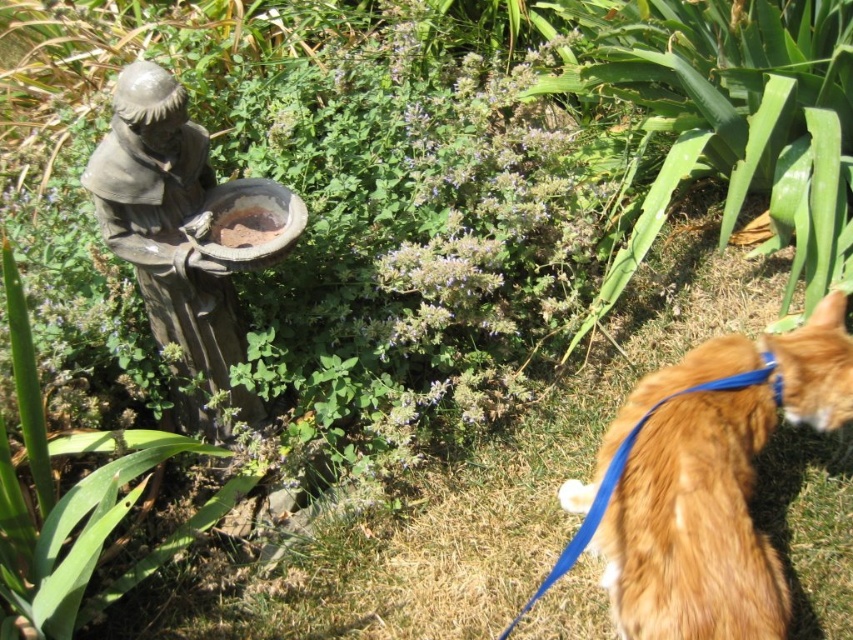
You are a photographer standing in the garden and want to take a picture of both the gray stone statue at upper left and the matte brown bowl at center. However, you notice that the statue is blocking part of the bowl. Can you adjust your position to capture both objects fully in the frame without any obstruction?

The gray stone statue at upper left is in front of the matte brown bowl at center, so moving to the side opposite of the statue would allow you to see both objects without obstruction.

You are a gardener looking at the garden scene. You notice the orange fur at lower right and the matte brown bowl at center. Which object is positioned lower in the image?

The orange fur at lower right is positioned below the matte brown bowl at center, so it is lower in the image.